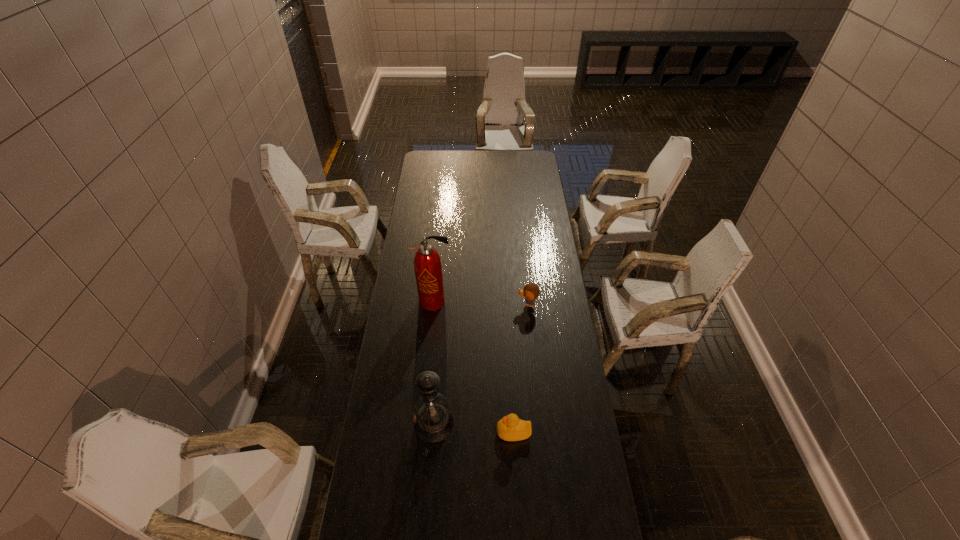
This screenshot has width=960, height=540. I want to click on free spot between the oil lamp and the nearer duck, so click(x=474, y=428).

Image resolution: width=960 pixels, height=540 pixels. I want to click on unoccupied area between the oil lamp and the farther duck, so click(481, 363).

The image size is (960, 540). In order to click on vacant space that is in between the fire extinguisher and the nearer duck in this screenshot , I will do `click(474, 367)`.

At what (x,y) coordinates should I click in order to perform the action: click on blank region between the farther duck and the tallest object. Please return your answer as a coordinate pair (x, y). This screenshot has height=540, width=960. Looking at the image, I should click on (481, 302).

This screenshot has width=960, height=540. I want to click on vacant area that lies between the farther duck and the fire extinguisher, so click(481, 302).

Identify the location of vacant region between the nearer duck and the fire extinguisher. This screenshot has height=540, width=960. (474, 367).

Locate an element on the screen. The image size is (960, 540). empty space that is in between the nearer duck and the oil lamp is located at coordinates (474, 428).

Find the location of a particular element. free space between the tallest object and the nearer duck is located at coordinates (474, 367).

The width and height of the screenshot is (960, 540). Find the location of `empty location between the fire extinguisher and the oil lamp`. empty location between the fire extinguisher and the oil lamp is located at coordinates (434, 362).

Image resolution: width=960 pixels, height=540 pixels. Find the location of `free space between the nearer duck and the farther duck`. free space between the nearer duck and the farther duck is located at coordinates (520, 368).